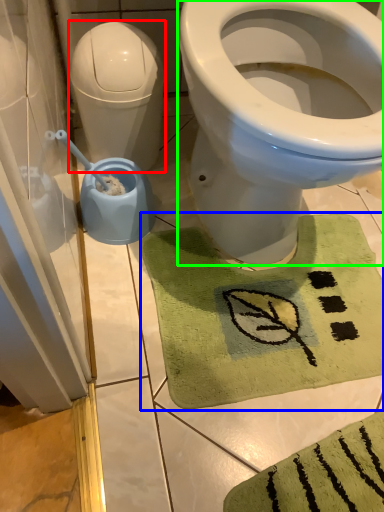
Question: Which is nearer to the water tank (highlighted by a red box)? bath mat (highlighted by a blue box) or bidet (highlighted by a green box).

Choices:
 (A) bath mat
 (B) bidet

Answer: (B)